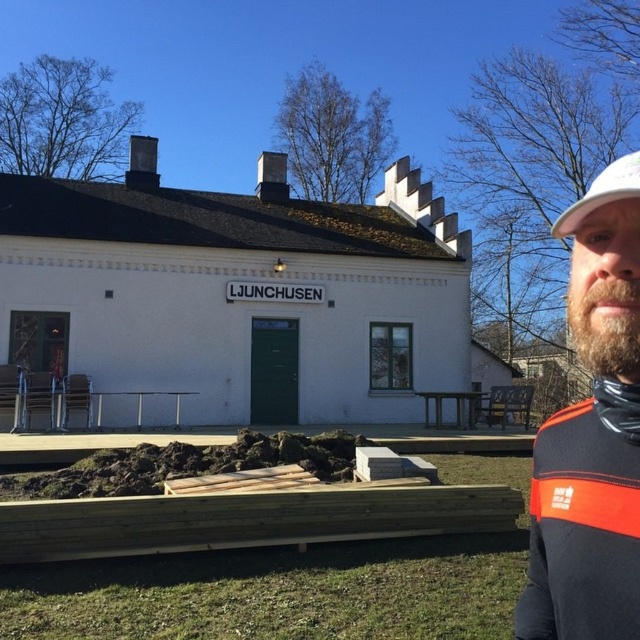
Who is positioned more to the left, dark brown leather jacket at right or brownwoodybeard at right?

From the viewer's perspective, dark brown leather jacket at right appears more on the left side.

Does dark brown leather jacket at right have a greater width compared to brownwoodybeard at right?

No, dark brown leather jacket at right is not wider than brownwoodybeard at right.

Does point (576, 486) come behind point (600, 305)?

Yes, it is.

Where is `dark brown leather jacket at right`? The width and height of the screenshot is (640, 640). dark brown leather jacket at right is located at coordinates (592, 435).

Can you confirm if dark brown leather jacket at right is taller than white matte baseball cap at upper right?

Incorrect, dark brown leather jacket at right's height is not larger of white matte baseball cap at upper right's.

Between dark brown leather jacket at right and white matte baseball cap at upper right, which one is positioned lower?

dark brown leather jacket at right is below.

Between point (582, 630) and point (625, 196), which one is positioned in front?

Point (582, 630)

Locate an element on the screen. The image size is (640, 640). dark brown leather jacket at right is located at coordinates pos(592,435).

Is brownwoodybeard at right smaller than white matte baseball cap at upper right?

Yes.

Which is in front, point (624, 292) or point (588, 212)?

Positioned in front is point (624, 292).

Find the location of a particular element. brownwoodybeard at right is located at coordinates (605, 324).